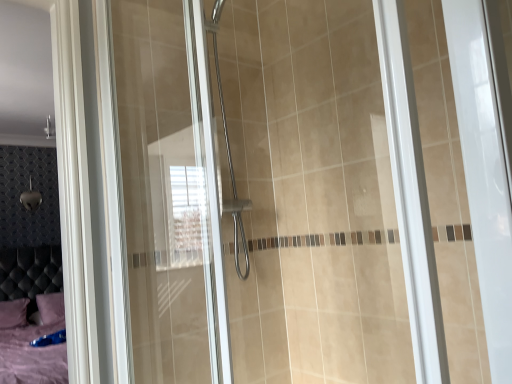
Question: From the image's perspective, is transparent glass shower door at center located beneath purple fabric pillow at lower left, which appears as the 1th pillow when viewed from the left?

Choices:
 (A) no
 (B) yes

Answer: (A)

Question: Does transparent glass shower door at center have a lesser height compared to purple fabric pillow at lower left, which appears as the 1th pillow when viewed from the left?

Choices:
 (A) no
 (B) yes

Answer: (A)

Question: Is transparent glass shower door at center beside purple fabric pillow at lower left, acting as the 2th pillow starting from the right?

Choices:
 (A) no
 (B) yes

Answer: (A)

Question: Is transparent glass shower door at center wider than purple fabric pillow at lower left, which appears as the 1th pillow when viewed from the left?

Choices:
 (A) yes
 (B) no

Answer: (B)

Question: From a real-world perspective, does transparent glass shower door at center stand above purple fabric pillow at lower left, acting as the 2th pillow starting from the right?

Choices:
 (A) yes
 (B) no

Answer: (A)

Question: Is transparent glass shower door at center spatially inside purple fabric pillow at lower left, the second pillow from the left, or outside of it?

Choices:
 (A) outside
 (B) inside

Answer: (A)

Question: Is point (345, 6) positioned closer to the camera than point (64, 307)?

Choices:
 (A) farther
 (B) closer

Answer: (A)

Question: From their relative heights in the image, would you say transparent glass shower door at center is taller or shorter than purple fabric pillow at lower left, the first pillow viewed from the right?

Choices:
 (A) tall
 (B) short

Answer: (A)

Question: Based on their positions, is transparent glass shower door at center located to the left or right of purple fabric pillow at lower left, the first pillow viewed from the right?

Choices:
 (A) left
 (B) right

Answer: (B)

Question: Considering the positions of point (51, 302) and point (146, 233), is point (51, 302) closer or farther from the camera than point (146, 233)?

Choices:
 (A) closer
 (B) farther

Answer: (B)

Question: Is purple fabric pillow at lower left, the first pillow viewed from the right, bigger or smaller than transparent glass shower door at center?

Choices:
 (A) big
 (B) small

Answer: (B)

Question: Would you say purple fabric pillow at lower left, the second pillow from the left, is to the left or to the right of transparent glass shower door at center in the picture?

Choices:
 (A) left
 (B) right

Answer: (A)

Question: In terms of width, does purple fabric pillow at lower left, the first pillow viewed from the right, look wider or thinner when compared to transparent glass shower door at center?

Choices:
 (A) thin
 (B) wide

Answer: (B)

Question: Is point (23, 314) closer or farther from the camera than point (286, 153)?

Choices:
 (A) farther
 (B) closer

Answer: (A)

Question: Would you say purple fabric pillow at lower left, which appears as the 1th pillow when viewed from the left, is to the left or to the right of transparent glass shower door at center in the picture?

Choices:
 (A) right
 (B) left

Answer: (B)